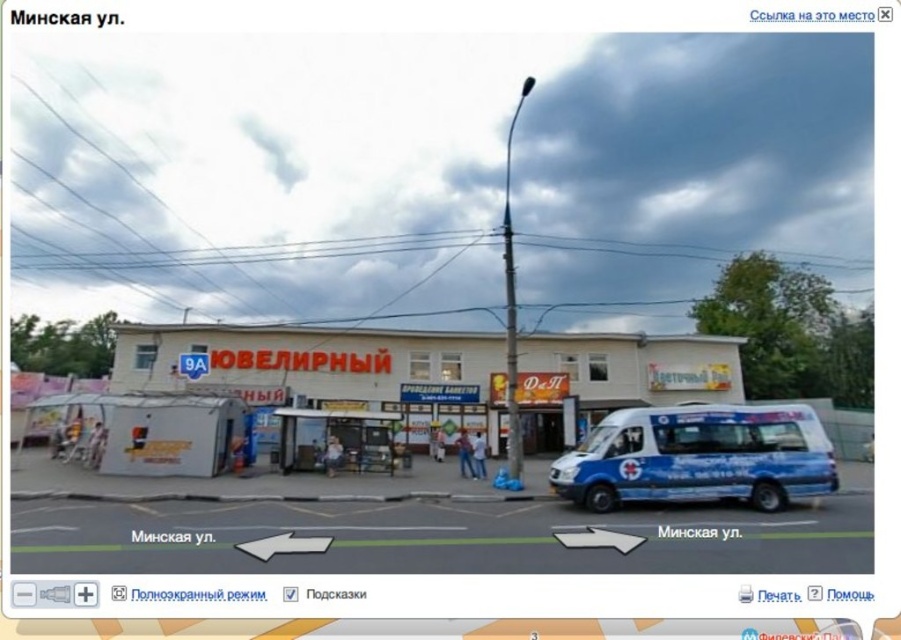
You are a delivery driver who needs to park your van in a spot that allows you to see the entrance of the white matte building at center. Given the current position of the blue metallic van at right, can you park your van in a way that still allows visibility to the building entrance?

The white matte building at center is located above the blue metallic van at right, meaning the van is blocking the direct line of sight to the building entrance. Therefore, you cannot park your van in a way that allows visibility to the entrance while the blue metallic van at right is in its current position.

You are standing at the point with coordinates point [248,381] and want to walk to the point [686,499]. Which direction should you move to reach your destination?

You should move forward because point [248,381] is behind point [686,499], so moving forward from point [248,381] will lead you to point [686,499].

You are a delivery driver who needs to park a new van between the blue metallic van at center and the blue metallic van at right. Given that your van is 2.5 meters wide, can you fit it there?

The blue metallic van at center is wider than the blue metallic van at right. However, without knowing the exact widths of both vans or the space between them, it is impossible to determine if your 2.5 meter wide van can fit between them.